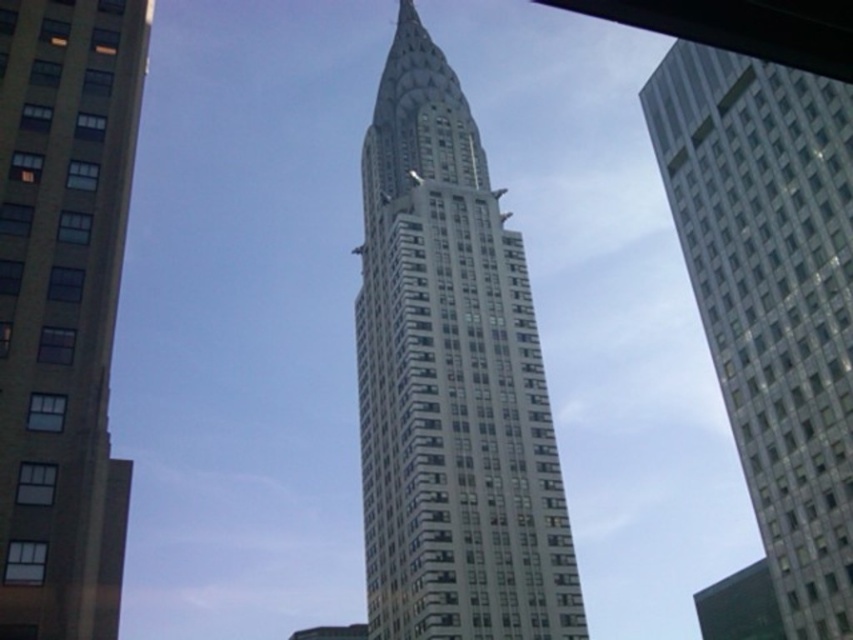
You are standing in the middle of a city square and see the glassy white skyscraper at right and the smooth concrete building at center. Which building is positioned to the east if the sun is setting in the west?

The glassy white skyscraper at right is to the right of smooth concrete building at center. Since the sun is setting in the west, the building casting a shadow to the east would be the glassy white skyscraper at right.